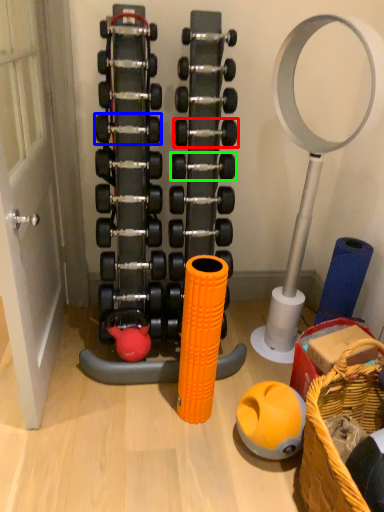
Question: Estimate the real-world distances between objects in this image. Which object is closer to dumbbell (highlighted by a red box), dumbbell (highlighted by a blue box) or dumbbell (highlighted by a green box)?

Choices:
 (A) dumbbell
 (B) dumbbell

Answer: (B)